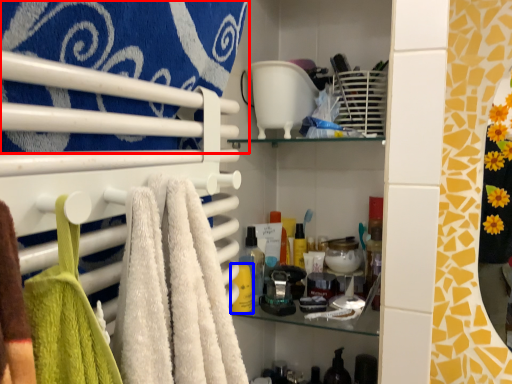
Question: Among these objects, which one is nearest to the camera, towel (highlighted by a red box) or toiletry (highlighted by a blue box)?

Choices:
 (A) towel
 (B) toiletry

Answer: (A)